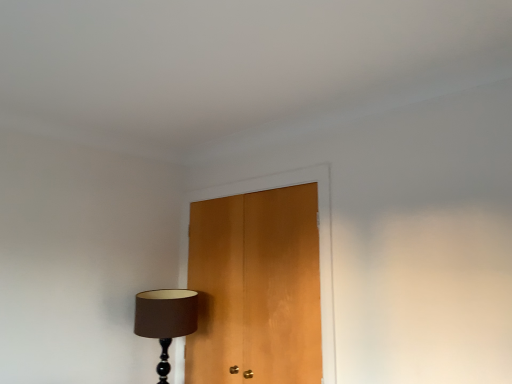
Question: In terms of height, does wooden door at center look taller or shorter compared to matte brown lampshade at lower left?

Choices:
 (A) short
 (B) tall

Answer: (B)

Question: Considering the positions of point (195, 258) and point (147, 322), is point (195, 258) closer or farther from the camera than point (147, 322)?

Choices:
 (A) closer
 (B) farther

Answer: (B)

Question: In the image, is wooden door at center positioned in front of or behind matte brown lampshade at lower left?

Choices:
 (A) front
 (B) behind

Answer: (A)

Question: Would you say matte brown lampshade at lower left is inside or outside wooden door at center?

Choices:
 (A) inside
 (B) outside

Answer: (B)

Question: In terms of height, does matte brown lampshade at lower left look taller or shorter compared to wooden door at center?

Choices:
 (A) tall
 (B) short

Answer: (B)

Question: Relative to wooden door at center, is matte brown lampshade at lower left in front or behind?

Choices:
 (A) front
 (B) behind

Answer: (B)

Question: In terms of width, does matte brown lampshade at lower left look wider or thinner when compared to wooden door at center?

Choices:
 (A) wide
 (B) thin

Answer: (A)